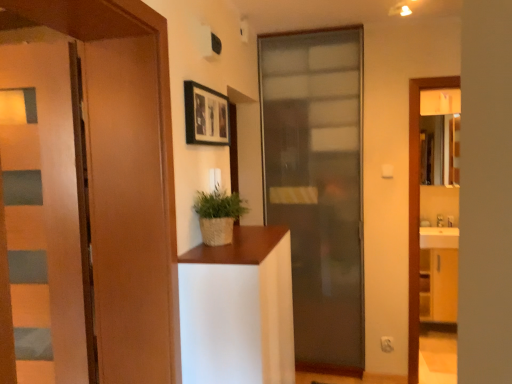
Question: Can you confirm if braided straw pot at center is bigger than wooden door at left, which is the 2th door in front-to-back order?

Choices:
 (A) no
 (B) yes

Answer: (B)

Question: Is braided straw pot at center located outside wooden door at left, which is the 2th door in front-to-back order?

Choices:
 (A) yes
 (B) no

Answer: (A)

Question: Is braided straw pot at center facing away from wooden door at left, which is the 2th door in front-to-back order?

Choices:
 (A) yes
 (B) no

Answer: (B)

Question: Is braided straw pot at center directly adjacent to wooden door at left, which is the 2th door in front-to-back order?

Choices:
 (A) no
 (B) yes

Answer: (A)

Question: Does braided straw pot at center have a lesser width compared to wooden door at left, arranged as the 1th door when viewed from the left?

Choices:
 (A) yes
 (B) no

Answer: (B)

Question: Which is correct: wooden door at left, which is the 2th door in front-to-back order, is inside translucent glass door at center, arranged as the 3th door when viewed from the front, or outside of it?

Choices:
 (A) outside
 (B) inside

Answer: (A)

Question: From a real-world perspective, is wooden door at left, the third door positioned from the right, positioned above or below translucent glass door at center, arranged as the 3th door when viewed from the front?

Choices:
 (A) above
 (B) below

Answer: (A)

Question: Is wooden door at left, placed as the 2th door when sorted from back to front, wider or thinner than translucent glass door at center, acting as the 1th door starting from the right?

Choices:
 (A) thin
 (B) wide

Answer: (A)

Question: In terms of height, does wooden door at left, arranged as the 1th door when viewed from the left, look taller or shorter compared to translucent glass door at center, the third door viewed from the left?

Choices:
 (A) short
 (B) tall

Answer: (A)

Question: In the image, is matte brown door at left, acting as the 2th door starting from the right, positioned in front of or behind black matte picture frame at upper center?

Choices:
 (A) front
 (B) behind

Answer: (A)

Question: Do you think matte brown door at left, the 2th door positioned from the left, is within black matte picture frame at upper center, or outside of it?

Choices:
 (A) outside
 (B) inside

Answer: (A)

Question: Considering the positions of matte brown door at left, arranged as the 1th door when viewed from the front, and black matte picture frame at upper center in the image, is matte brown door at left, arranged as the 1th door when viewed from the front, taller or shorter than black matte picture frame at upper center?

Choices:
 (A) tall
 (B) short

Answer: (A)

Question: Is matte brown door at left, arranged as the 1th door when viewed from the front, wider or thinner than black matte picture frame at upper center?

Choices:
 (A) thin
 (B) wide

Answer: (B)

Question: Is point (206, 132) closer or farther from the camera than point (31, 264)?

Choices:
 (A) closer
 (B) farther

Answer: (B)

Question: From the image's perspective, is black matte picture frame at upper center above or below wooden door at left, the third door positioned from the right?

Choices:
 (A) above
 (B) below

Answer: (A)